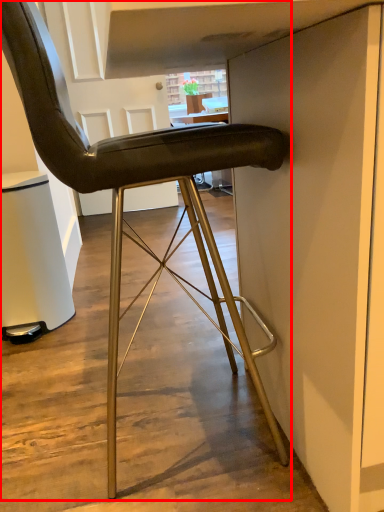
Question: From the image's perspective, considering the relative positions of chair (annotated by the red box) and cabinetry in the image provided, where is chair (annotated by the red box) located with respect to the staircase?

Choices:
 (A) above
 (B) below

Answer: (A)